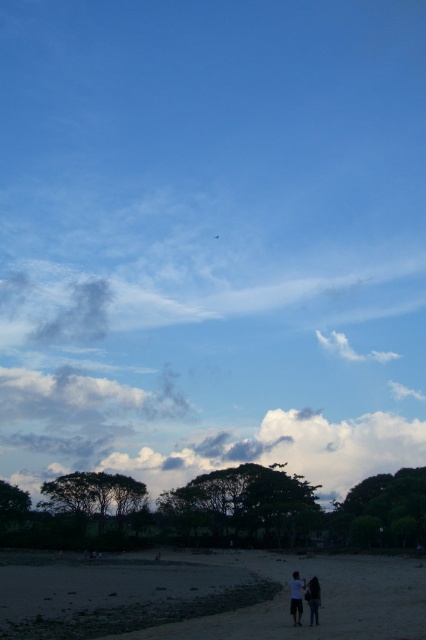
Is the position of dark green leafy tree at center more distant than that of dark blue jeans at lower center?

Yes, it is behind dark blue jeans at lower center.

Which is above, dark green leafy tree at center or dark blue jeans at lower center?

dark blue jeans at lower center

This screenshot has height=640, width=426. What are the coordinates of `dark green leafy tree at center` in the screenshot? It's located at (242, 508).

Is point (284, 545) closer to camera compared to point (409, 545)?

No, (284, 545) is further to viewer.

Who is more forward, (244, 492) or (374, 545)?

Point (374, 545) is in front.

The height and width of the screenshot is (640, 426). I want to click on dark green leafy tree at center, so click(x=242, y=508).

Is point (100, 474) positioned in front of point (299, 616)?

No, it is not.

How much distance is there between green leafy tree at lower center and jeans at lower right?

They are 62.17 meters apart.

Which is in front, point (69, 499) or point (313, 577)?

Point (313, 577) is more forward.

The width and height of the screenshot is (426, 640). I want to click on green leafy tree at lower center, so click(x=94, y=497).